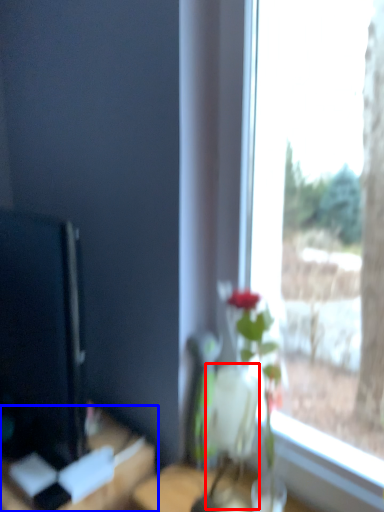
Question: Which of the following is the closest to the observer, vase (highlighted by a red box) or table (highlighted by a blue box)?

Choices:
 (A) vase
 (B) table

Answer: (A)